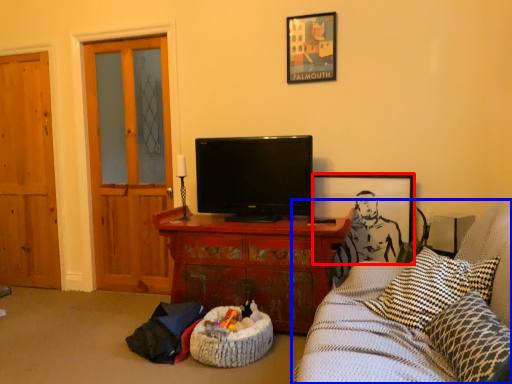
Question: Which object is further to the camera taking this photo, picture frame (highlighted by a red box) or studio couch (highlighted by a blue box)?

Choices:
 (A) picture frame
 (B) studio couch

Answer: (A)